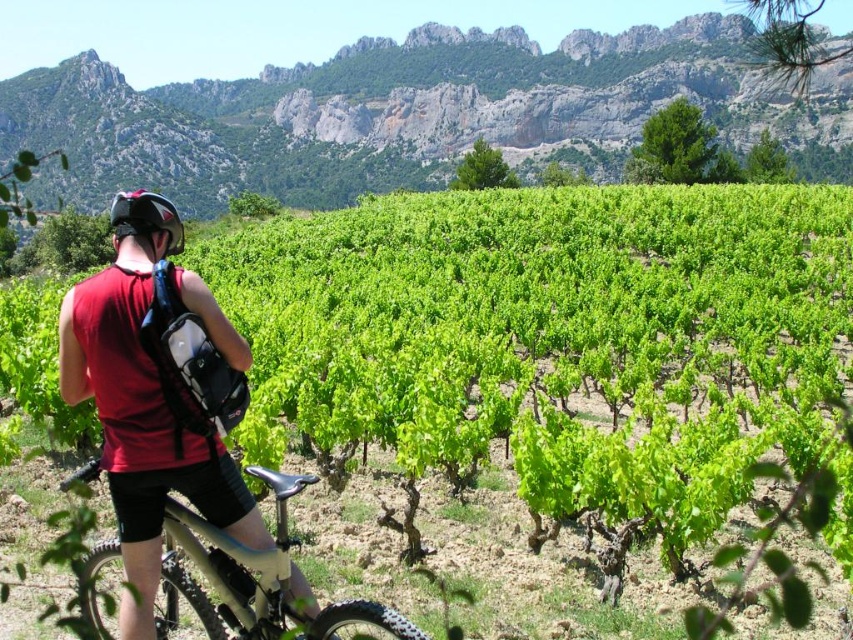
You are a drone operator planning to fly a drone from the rugged stone mountain at upper center to the metallic silver frame at center. The drone has a maximum flight range of 400 feet. Based on the scene, can the drone complete the flight without needing to recharge?

The rugged stone mountain at upper center is 423.08 feet away from the metallic silver frame at center. Since the drone can only fly 400 feet before needing to recharge, it cannot complete the flight without recharging.

You are a photographer trying to capture the cyclist and their equipment. You notice the metallic silver frame at center and the matte black helmet at upper left. Which object should you focus on first if you want to take a photo that includes both but prioritize the one closer to you?

The metallic silver frame at center is closer to the viewer than the matte black helmet at upper left, so you should focus on the metallic silver frame at center first to ensure it is in sharp focus while still including the matte black helmet at upper left in the background.